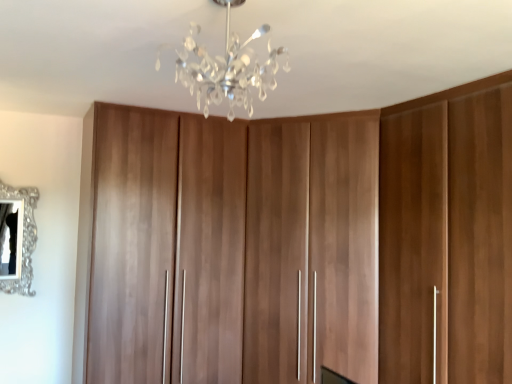
What do you see at coordinates (300, 243) in the screenshot? I see `walnut wood cupboard at center` at bounding box center [300, 243].

Where is `silver ornate mirror at left`? silver ornate mirror at left is located at coordinates (23, 237).

How far apart are silver ornate mirror at left and walnut wood cupboard at center?

A distance of 1.59 meters exists between silver ornate mirror at left and walnut wood cupboard at center.

Does silver ornate mirror at left touch walnut wood cupboard at center?

No, silver ornate mirror at left is not with walnut wood cupboard at center.

From the image's perspective, is silver ornate mirror at left above walnut wood cupboard at center?

Correct, silver ornate mirror at left appears higher than walnut wood cupboard at center in the image.

From the picture: From a real-world perspective, is silver ornate mirror at left positioned under walnut wood cupboard at center based on gravity?

No, from a real-world perspective, silver ornate mirror at left is not beneath walnut wood cupboard at center.

From the image's perspective, is clear crystal chandelier at upper center on top of walnut wood cupboard at center?

Yes, from the image's perspective, clear crystal chandelier at upper center is over walnut wood cupboard at center.

In the scene shown: Is the position of clear crystal chandelier at upper center less distant than that of walnut wood cupboard at center?

Yes, it is.

Between point (199, 56) and point (270, 242), which one is positioned in front?

The point (199, 56) is closer.

Is silver ornate mirror at left a part of clear crystal chandelier at upper center?

No, clear crystal chandelier at upper center does not contain silver ornate mirror at left.

How many degrees apart are the facing directions of clear crystal chandelier at upper center and silver ornate mirror at left?

The facing directions of clear crystal chandelier at upper center and silver ornate mirror at left are 90.2 degrees apart.

Is clear crystal chandelier at upper center placed right next to silver ornate mirror at left?

No, clear crystal chandelier at upper center is not beside silver ornate mirror at left.

From the image's perspective, does clear crystal chandelier at upper center appear higher than silver ornate mirror at left?

Yes, from the image's perspective, clear crystal chandelier at upper center is on top of silver ornate mirror at left.

Which is nearer, (230, 220) or (30, 280)?

The point (30, 280) is more forward.

In the image, is walnut wood cupboard at center on the left side or the right side of silver ornate mirror at left?

From the image, it's evident that walnut wood cupboard at center is to the right of silver ornate mirror at left.

Between walnut wood cupboard at center and silver ornate mirror at left, which one is positioned behind?

silver ornate mirror at left is behind.

Is walnut wood cupboard at center bigger than silver ornate mirror at left?

Indeed, walnut wood cupboard at center has a larger size compared to silver ornate mirror at left.

Can you tell me how much walnut wood cupboard at center and clear crystal chandelier at upper center differ in facing direction?

The angular difference between walnut wood cupboard at center and clear crystal chandelier at upper center is 91.2 degrees.

Does walnut wood cupboard at center have a greater width compared to clear crystal chandelier at upper center?

Yes, walnut wood cupboard at center is wider than clear crystal chandelier at upper center.

Is point (362, 307) more distant than point (199, 93)?

Yes, point (362, 307) is behind point (199, 93).

From the image's perspective, is walnut wood cupboard at center below clear crystal chandelier at upper center?

Correct, walnut wood cupboard at center appears lower than clear crystal chandelier at upper center in the image.

Does silver ornate mirror at left have a smaller size compared to clear crystal chandelier at upper center?

Yes, silver ornate mirror at left is smaller than clear crystal chandelier at upper center.

Between silver ornate mirror at left and clear crystal chandelier at upper center, which one appears on the left side from the viewer's perspective?

silver ornate mirror at left.

Which of these two, silver ornate mirror at left or clear crystal chandelier at upper center, is wider?

clear crystal chandelier at upper center.

Considering the relative sizes of silver ornate mirror at left and clear crystal chandelier at upper center in the image provided, is silver ornate mirror at left taller than clear crystal chandelier at upper center?

Correct, silver ornate mirror at left is much taller as clear crystal chandelier at upper center.

Locate an element on the screen. The image size is (512, 384). cupboard below the silver ornate mirror at left (from a real-world perspective) is located at coordinates (300, 243).

Image resolution: width=512 pixels, height=384 pixels. In order to click on lamp in front of the walnut wood cupboard at center in this screenshot , I will do `click(227, 69)`.

Based on their spatial positions, is clear crystal chandelier at upper center or walnut wood cupboard at center closer to silver ornate mirror at left?

walnut wood cupboard at center.

Looking at the image, which one is located closer to walnut wood cupboard at center, silver ornate mirror at left or clear crystal chandelier at upper center?

clear crystal chandelier at upper center lies closer to walnut wood cupboard at center than the other object.

In the scene shown: Based on their spatial positions, is walnut wood cupboard at center or silver ornate mirror at left closer to clear crystal chandelier at upper center?

walnut wood cupboard at center is positioned closer to the anchor clear crystal chandelier at upper center.

Considering their positions, is clear crystal chandelier at upper center positioned closer to walnut wood cupboard at center than silver ornate mirror at left?

clear crystal chandelier at upper center is positioned closer to the anchor walnut wood cupboard at center.

From the image, which object appears to be nearer to clear crystal chandelier at upper center, silver ornate mirror at left or walnut wood cupboard at center?

The object closer to clear crystal chandelier at upper center is walnut wood cupboard at center.

From the image, which object appears to be farther from silver ornate mirror at left, walnut wood cupboard at center or clear crystal chandelier at upper center?

clear crystal chandelier at upper center is further to silver ornate mirror at left.

Locate an element on the screen. The width and height of the screenshot is (512, 384). cupboard between clear crystal chandelier at upper center and silver ornate mirror at left from front to back is located at coordinates (300, 243).